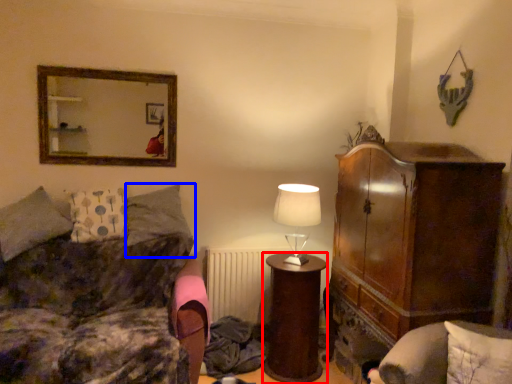
Question: Which of the following is the farthest to the observer, desk (highlighted by a red box) or pillow (highlighted by a blue box)?

Choices:
 (A) desk
 (B) pillow

Answer: (B)